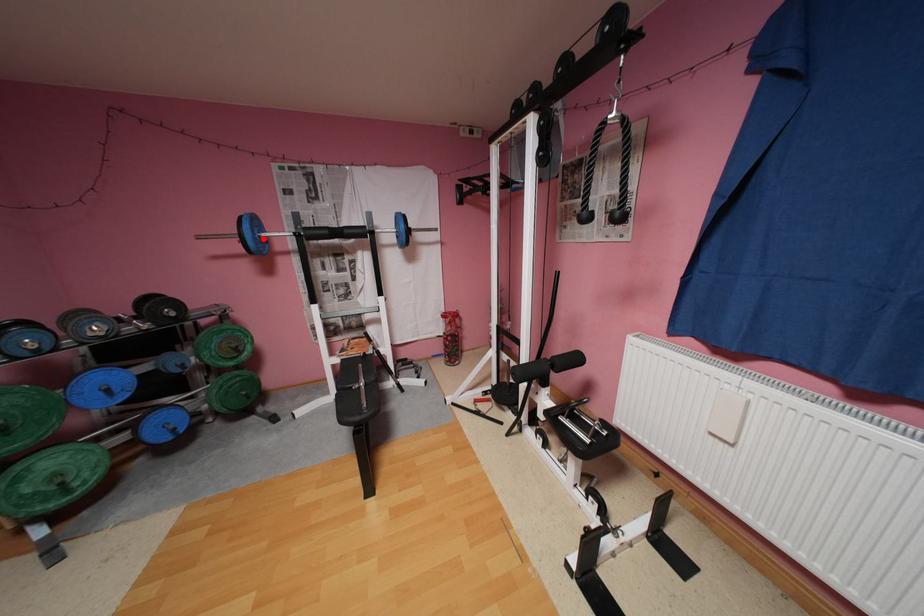
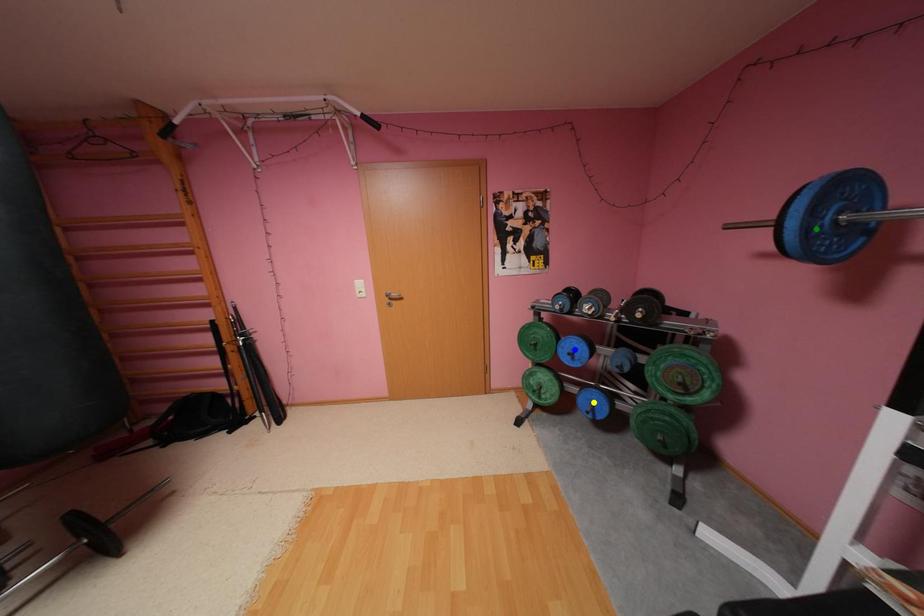
Question: I am providing you with two images of the same scene from different viewpoints. A red point is marked on the first image. You are given multiple points on the second image. Which point in image 2 represents the same 3d spot as the red point in image 1?

Choices:
 (A) blue point
 (B) yellow point
 (C) green point

Answer: (C)